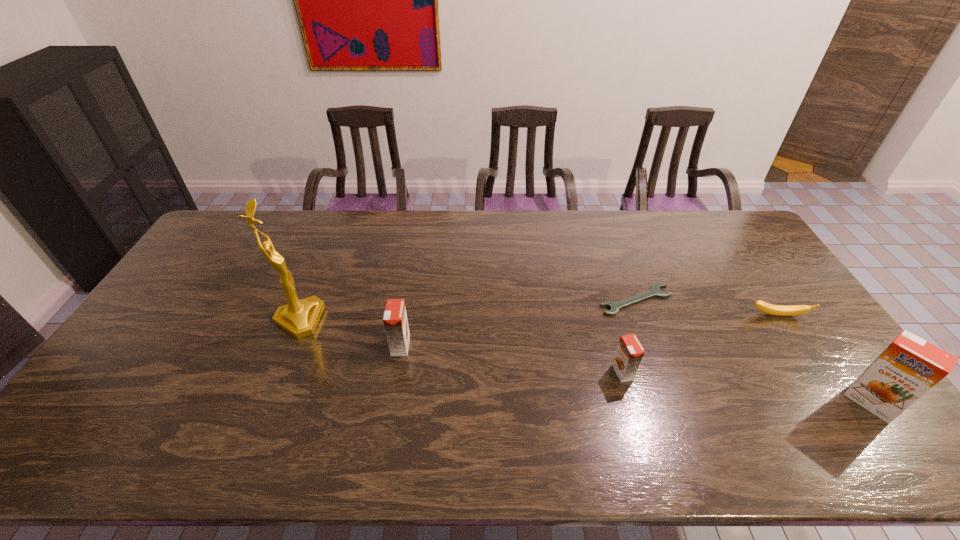
The image size is (960, 540). In order to click on vacant space that satisfies the following two spatial constraints: 1. on the front side of the third shortest object; 2. on the left side of the second tallest orange juice in this screenshot , I will do `click(396, 372)`.

Where is `vacant space that satisfies the following two spatial constraints: 1. on the front-facing side of the rightmost orange juice; 2. on the right side of the tallest object`? The height and width of the screenshot is (540, 960). vacant space that satisfies the following two spatial constraints: 1. on the front-facing side of the rightmost orange juice; 2. on the right side of the tallest object is located at coordinates (266, 402).

Identify the location of vacant space that satisfies the following two spatial constraints: 1. on the front-facing side of the award; 2. on the left side of the fourth shortest object. (289, 346).

Where is `free spot that satisfies the following two spatial constraints: 1. on the back side of the wrench; 2. on the left side of the third shortest object`? The image size is (960, 540). free spot that satisfies the following two spatial constraints: 1. on the back side of the wrench; 2. on the left side of the third shortest object is located at coordinates (603, 300).

Locate an element on the screen. free space that satisfies the following two spatial constraints: 1. at the stem of the second shortest object; 2. on the front-facing side of the leftmost object is located at coordinates (780, 320).